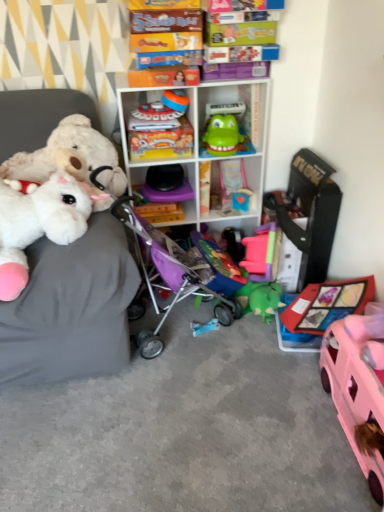
Question: Does black plastic toy at center, the eighth toy viewed from the left, have a smaller size compared to fluffy white stuffed animals on the left?

Choices:
 (A) yes
 (B) no

Answer: (A)

Question: Is black plastic toy at center, the eighth toy viewed from the left, positioned far away from fluffy white stuffed animals on the left?

Choices:
 (A) yes
 (B) no

Answer: (B)

Question: From a real-world perspective, is black plastic toy at center, the eighth toy viewed from the left, below fluffy white stuffed animals on the left?

Choices:
 (A) no
 (B) yes

Answer: (B)

Question: Can you confirm if black plastic toy at center, the eighth toy viewed from the left, is thinner than fluffy white stuffed animals on the left?

Choices:
 (A) yes
 (B) no

Answer: (A)

Question: Is black plastic toy at center, the eighth toy viewed from the left, positioned beyond the bounds of fluffy white stuffed animals on the left?

Choices:
 (A) yes
 (B) no

Answer: (A)

Question: In the image, is fluffy white plush at left, the 1th toy when ordered from left to right, on the left side or the right side of blue plastic toy at center, the second toy in the right-to-left sequence?

Choices:
 (A) right
 (B) left

Answer: (B)

Question: Is fluffy white plush at left, which is the 10th toy from right to left, bigger or smaller than blue plastic toy at center, the ninth toy viewed from the left?

Choices:
 (A) small
 (B) big

Answer: (B)

Question: Considering the positions of fluffy white plush at left, the 1th toy when ordered from left to right, and blue plastic toy at center, the ninth toy viewed from the left, in the image, is fluffy white plush at left, the 1th toy when ordered from left to right, wider or thinner than blue plastic toy at center, the ninth toy viewed from the left,?

Choices:
 (A) wide
 (B) thin

Answer: (A)

Question: Is fluffy white plush at left, the 1th toy when ordered from left to right, situated inside blue plastic toy at center, the ninth toy viewed from the left, or outside?

Choices:
 (A) outside
 (B) inside

Answer: (A)

Question: Considering their positions, is purple fabric baby carriage at center located in front of or behind white plastic shelf at center, the second shelf in the bottom-to-top sequence?

Choices:
 (A) front
 (B) behind

Answer: (A)

Question: Is purple fabric baby carriage at center inside or outside of white plastic shelf at center, the 1th shelf viewed from the top?

Choices:
 (A) outside
 (B) inside

Answer: (A)

Question: In the image, is purple fabric baby carriage at center on the left side or the right side of white plastic shelf at center, the second shelf in the bottom-to-top sequence?

Choices:
 (A) left
 (B) right

Answer: (A)

Question: In terms of height, does purple fabric baby carriage at center look taller or shorter compared to white plastic shelf at center, the 1th shelf viewed from the top?

Choices:
 (A) tall
 (B) short

Answer: (B)

Question: From a real-world perspective, is shiny metallic train at upper center, which is counted as the third toy, starting from the left, physically located above or below green rubber toy at center, which ranks as the 7th toy in left-to-right order?

Choices:
 (A) below
 (B) above

Answer: (B)

Question: Is shiny metallic train at upper center, which is the eighth toy in right-to-left order, wider or thinner than green rubber toy at center, which ranks as the 4th toy in right-to-left order?

Choices:
 (A) thin
 (B) wide

Answer: (B)